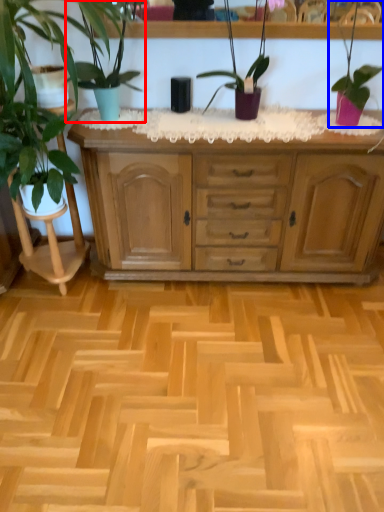
Question: Which object appears farthest to the camera in this image, houseplant (highlighted by a red box) or houseplant (highlighted by a blue box)?

Choices:
 (A) houseplant
 (B) houseplant

Answer: (B)